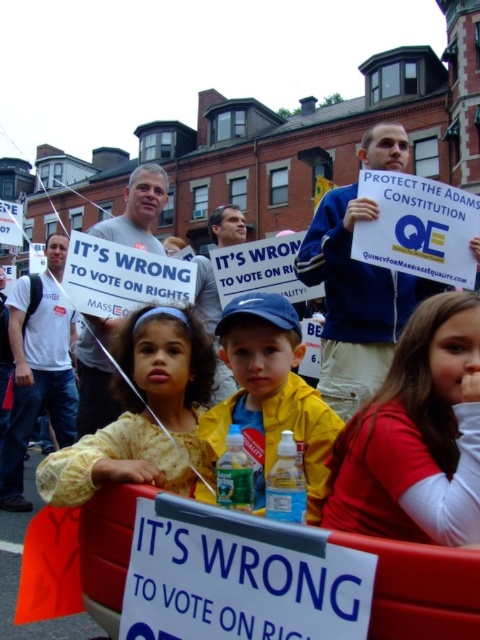
Measure the distance between red cotton shirt at lower right and camera.

The distance of red cotton shirt at lower right from camera is 69.23 feet.

From the picture: Is red cotton shirt at lower right taller than floral-patterned shirt at center?

Indeed, red cotton shirt at lower right has a greater height compared to floral-patterned shirt at center.

Does point (357, 464) come behind point (40, 483)?

No, it is in front of (40, 483).

The height and width of the screenshot is (640, 480). I want to click on red cotton shirt at lower right, so click(416, 436).

From the picture: Is floral-patterned shirt at center below yellow fabric jacket at center?

Correct, floral-patterned shirt at center is located below yellow fabric jacket at center.

Based on the photo, measure the distance between point (67, 502) and camera.

A distance of 23.74 meters exists between point (67, 502) and camera.

This screenshot has height=640, width=480. What are the coordinates of `floral-patterned shirt at center` in the screenshot? It's located at (168, 369).

Which of these two, red cotton shirt at lower right or yellow fabric jacket at center, stands shorter?

With less height is red cotton shirt at lower right.

Between red cotton shirt at lower right and yellow fabric jacket at center, which one has more height?

Standing taller between the two is yellow fabric jacket at center.

Where is `red cotton shirt at lower right`? red cotton shirt at lower right is located at coordinates (416, 436).